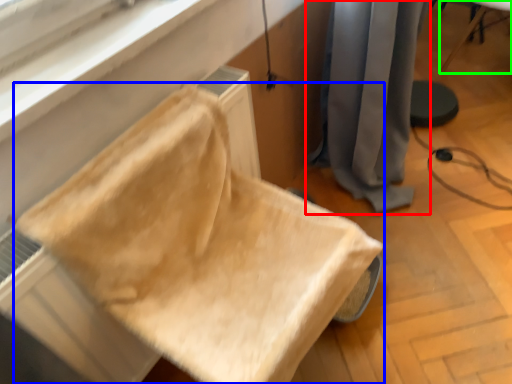
Question: Considering the real-world distances, which object is closest to curtain (highlighted by a red box)? furniture (highlighted by a blue box) or furniture (highlighted by a green box).

Choices:
 (A) furniture
 (B) furniture

Answer: (A)